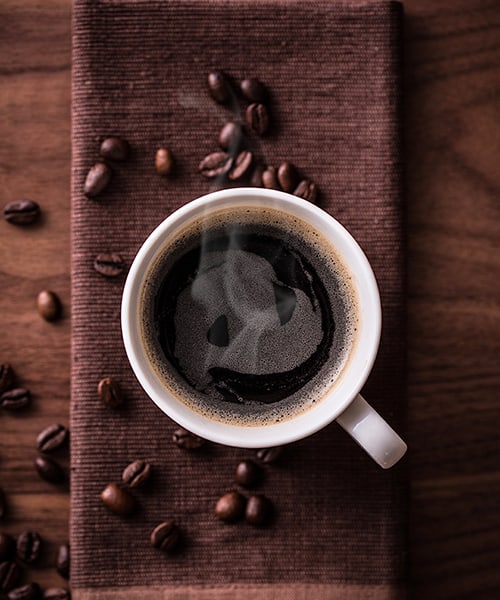
Locate an element on the screen. This screenshot has height=600, width=500. handle on coffee cup is located at coordinates tap(380, 452).